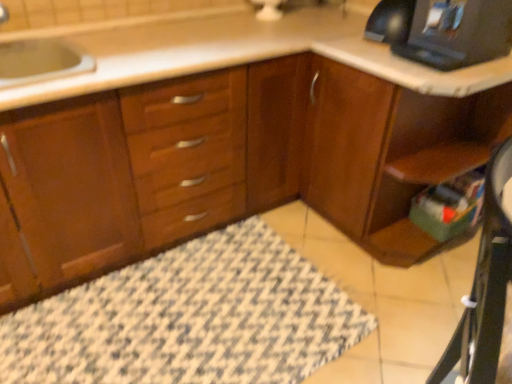
Question: Considering the positions of point (312, 92) and point (251, 349), is point (312, 92) closer or farther from the camera than point (251, 349)?

Choices:
 (A) farther
 (B) closer

Answer: (A)

Question: From a real-world perspective, is wooden cabinet at lower right physically located above or below patterned fabric bath mat at lower center?

Choices:
 (A) above
 (B) below

Answer: (A)

Question: Which object is the farthest from the black plastic desktop computer at upper right?

Choices:
 (A) patterned fabric bath mat at lower center
 (B) wooden computer desk at lower right
 (C) wooden cabinet at lower right
 (D) wooden cabinet at center

Answer: (A)

Question: Which object is the closest to the wooden computer desk at lower right?

Choices:
 (A) black plastic desktop computer at upper right
 (B) wooden cabinet at center
 (C) patterned fabric bath mat at lower center
 (D) wooden cabinet at lower right

Answer: (D)